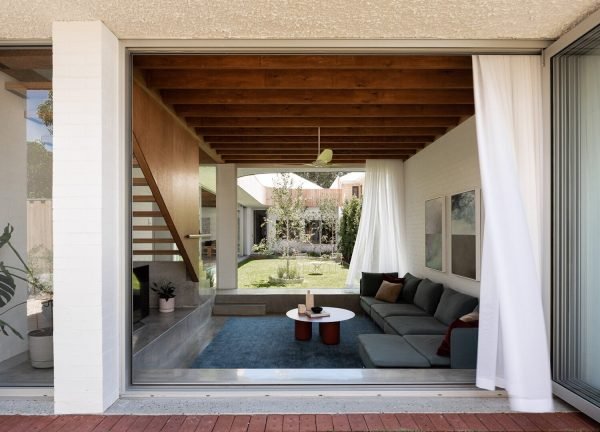
Where is `framed picture on wall`? The image size is (600, 432). framed picture on wall is located at coordinates (428, 237), (458, 241).